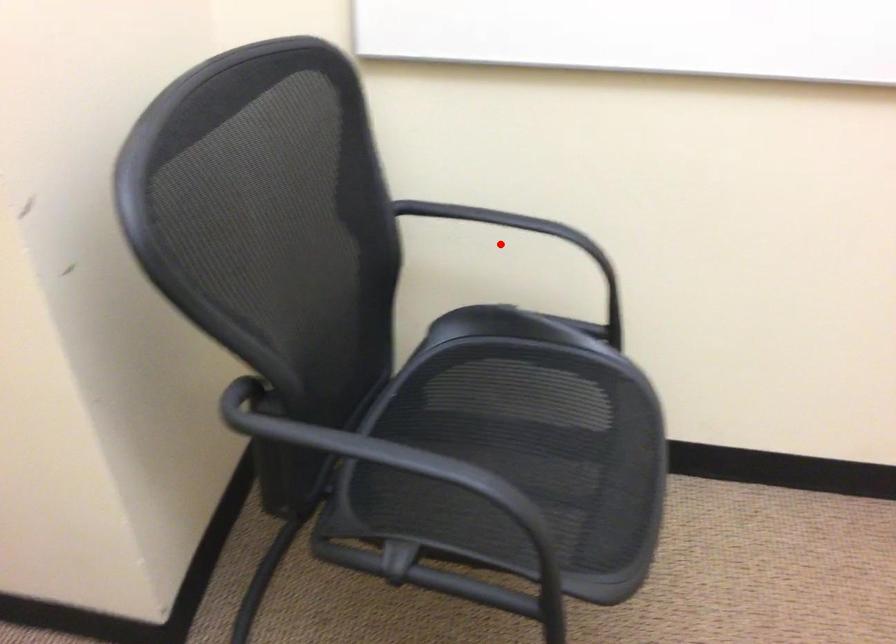
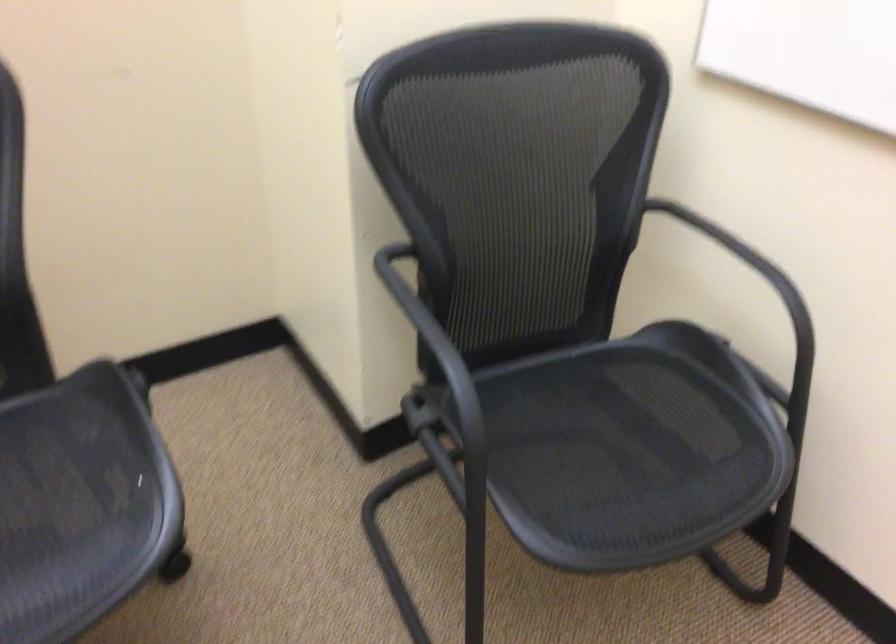
Find the pixel in the second image that matches the highlighted location in the first image.

(756, 286)